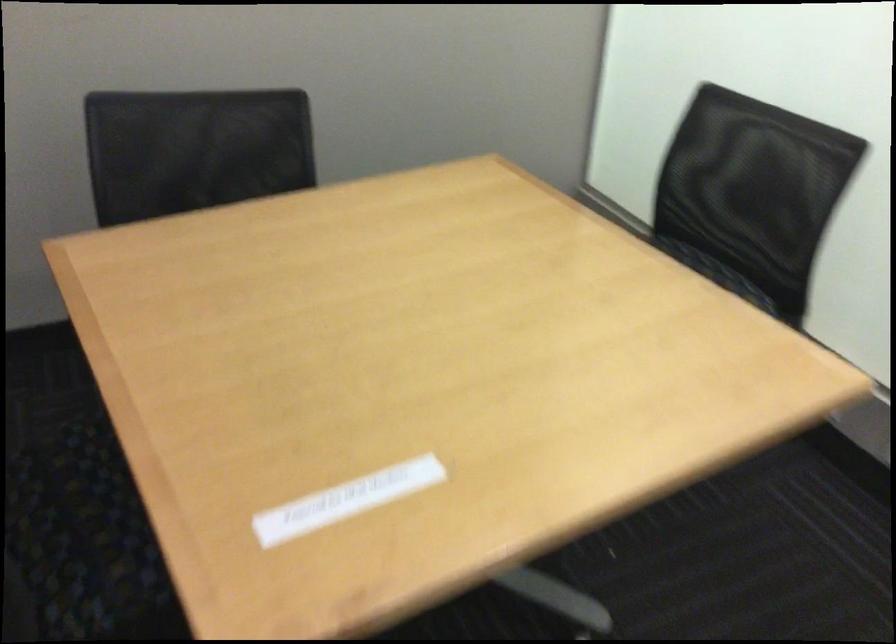
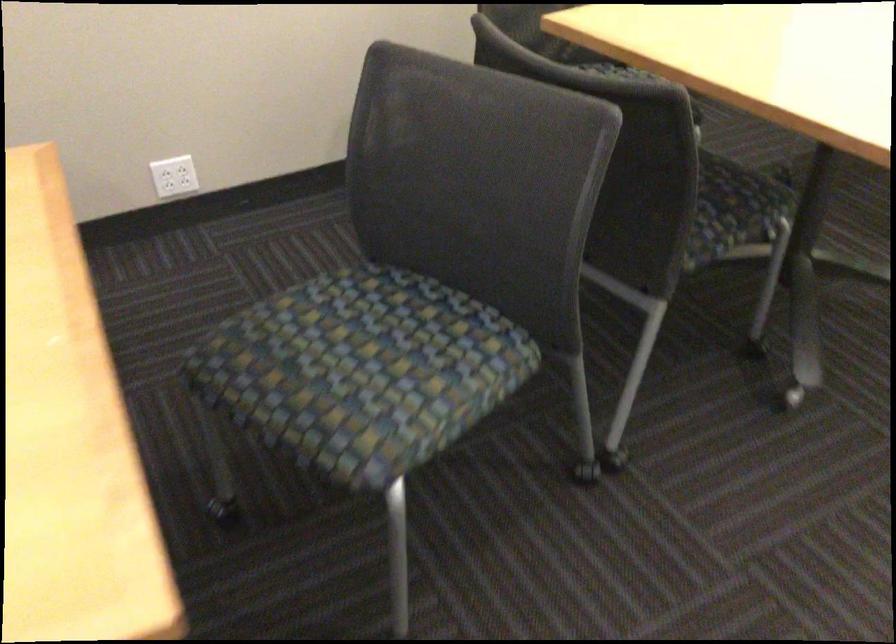
In a continuous first-person perspective shot, in which direction is the camera moving?

The cameraman moved toward left, backward.